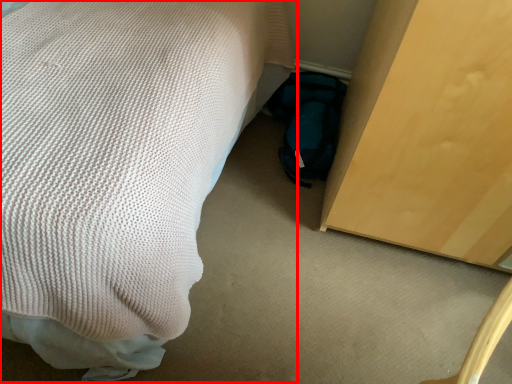
Question: Observing the image, what is the correct spatial positioning of bed (annotated by the red box) in reference to bag?

Choices:
 (A) left
 (B) right

Answer: (A)